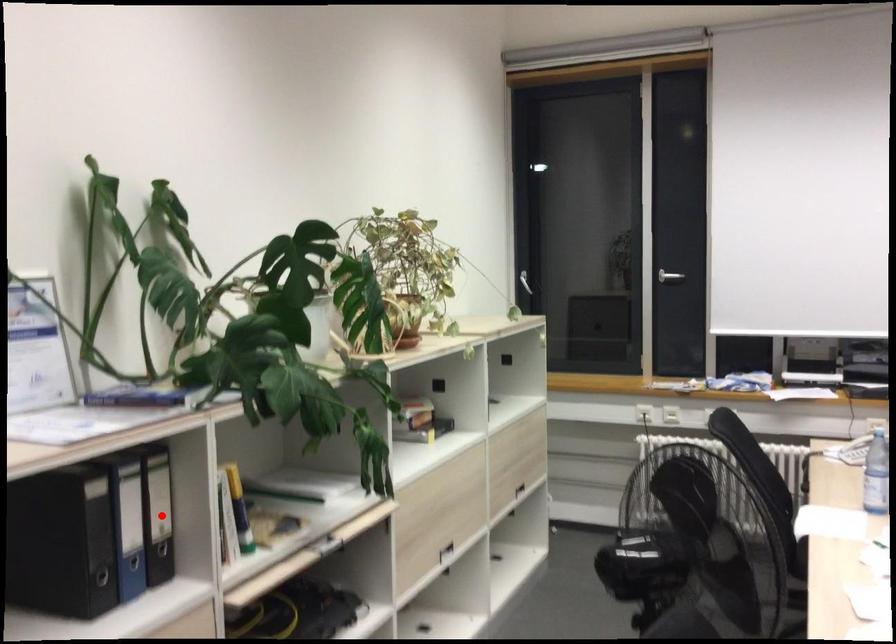
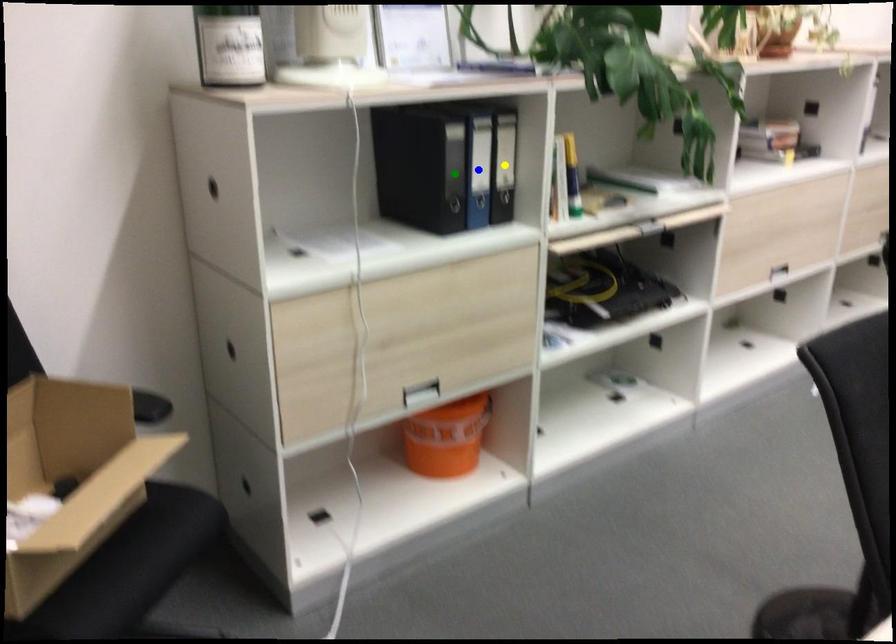
Question: I am providing you with two images of the same scene from different viewpoints. A red point is marked on the first image. You are given multiple points on the second image. Which spot in image 2 lines up with the point in image 1?

Choices:
 (A) blue point
 (B) yellow point
 (C) green point

Answer: (B)